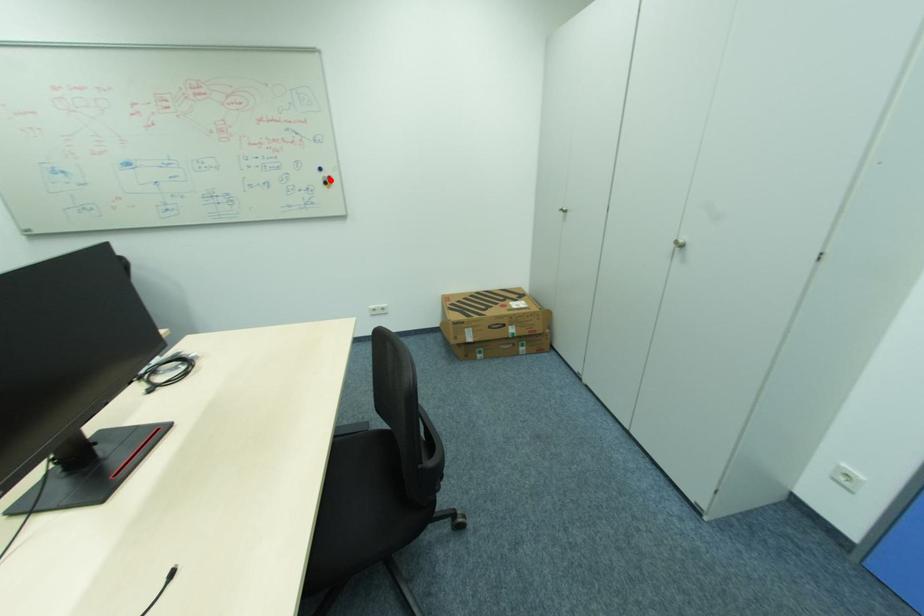
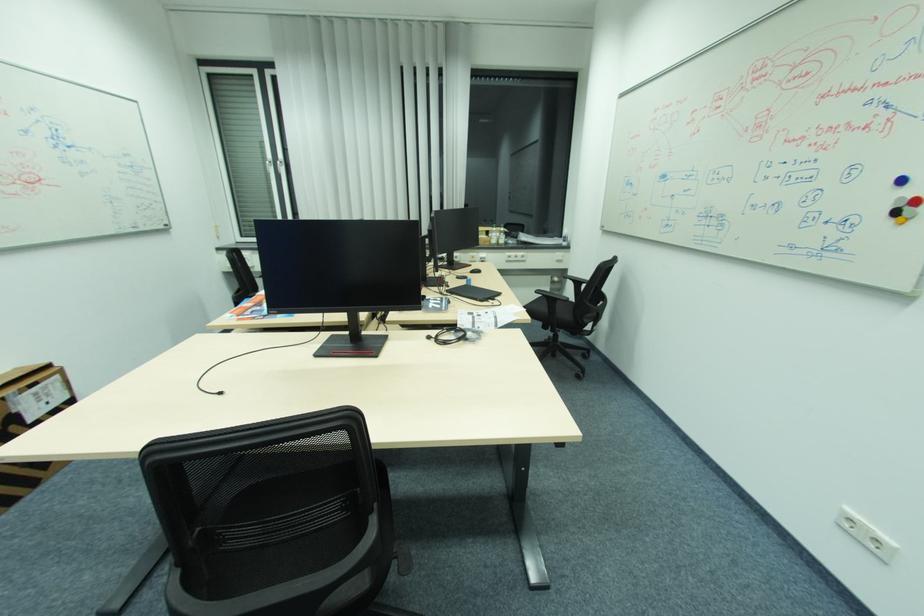
Find the pixel in the second image that matches the highlighted location in the first image.

(907, 206)